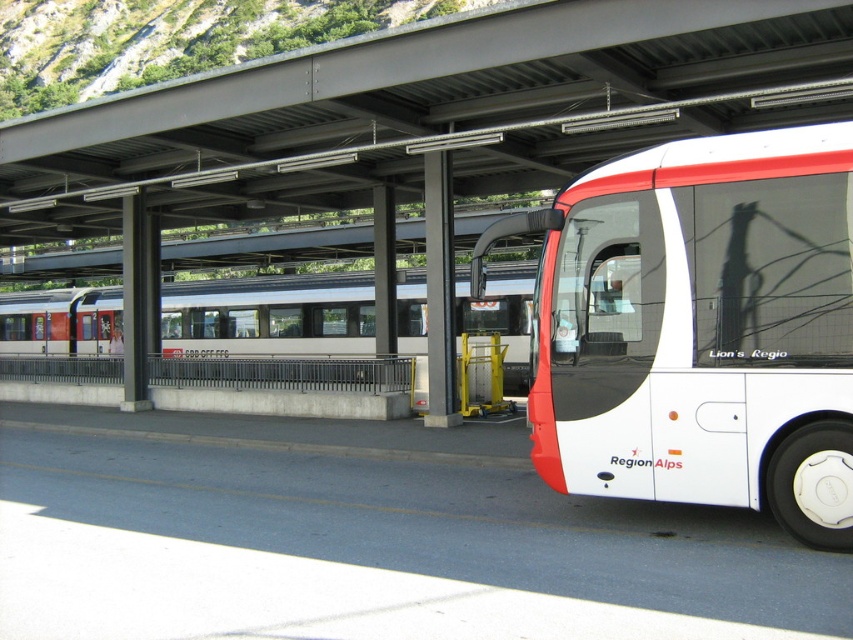
Question: Can you confirm if white matte bus at right is positioned to the left of silver metallic train at center?

Choices:
 (A) no
 (B) yes

Answer: (A)

Question: Can you confirm if white matte bus at right is positioned below silver metallic train at center?

Choices:
 (A) yes
 (B) no

Answer: (B)

Question: Which object is farther from the camera taking this photo?

Choices:
 (A) white matte bus at right
 (B) silver metallic train at center

Answer: (B)

Question: Which point is closer to the camera?

Choices:
 (A) (750, 380)
 (B) (100, 349)

Answer: (A)

Question: Is white matte bus at right positioned in front of silver metallic train at center?

Choices:
 (A) yes
 (B) no

Answer: (A)